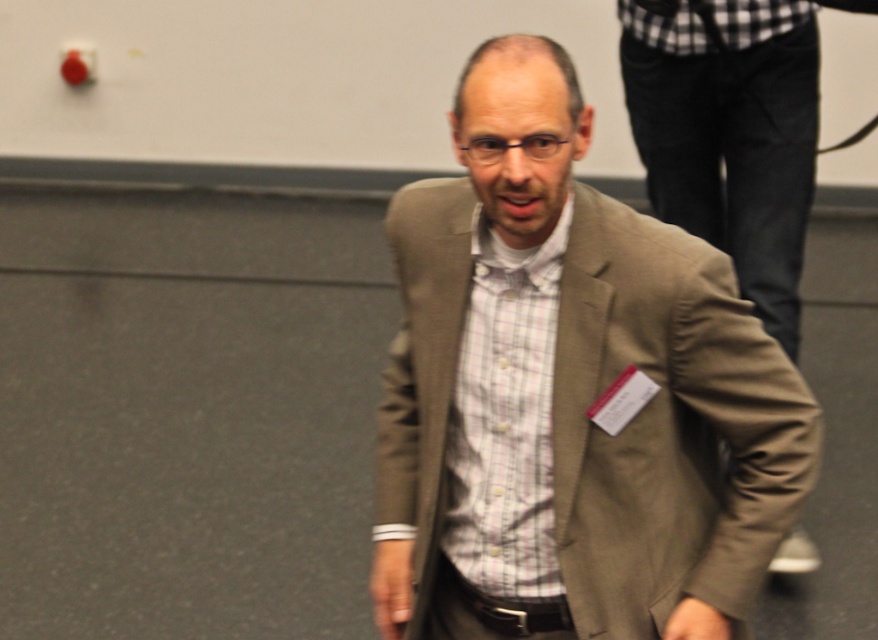
You are standing in a conference room and see two points marked on the wall. The first point is at coordinates point (548, 600) and the second is at point (793, 163). If you were to walk towards the wall, which point would you encounter first?

Point (548, 600) is in front of point (793, 163), so you would encounter point (548, 600) first when walking towards the wall.

Looking at this image, you are organizing a formal event and need to arrange two blazers on a rack. The rack has a width of 1.5 meters. Given the distance between the matte brown blazer at center and the matte beige blazer at center, will both fit on the rack without overlapping?

The matte brown blazer at center is 1.44 meters from the matte beige blazer at center, so they can fit on the 1.5 meter rack without overlapping as the required space is less than the rack width.

You are a photographer standing at a distance, and you need to capture a closeup shot of the matte brown blazer at center. Given that your camera has a minimum focusing distance of 1.5 meters, will you be able to take the photo without moving closer?

The distance between the matte brown blazer at center and the camera is 1.72 meters. Since the minimum focusing distance is 1.5 meters, the camera can focus at 1.72 meters, so yes, you can take the closeup shot without moving closer.